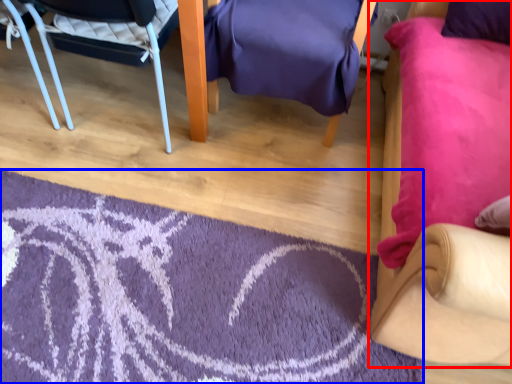
Question: Which point is closer to the camera, chair (highlighted by a red box) or mat (highlighted by a blue box)?

Choices:
 (A) chair
 (B) mat

Answer: (A)